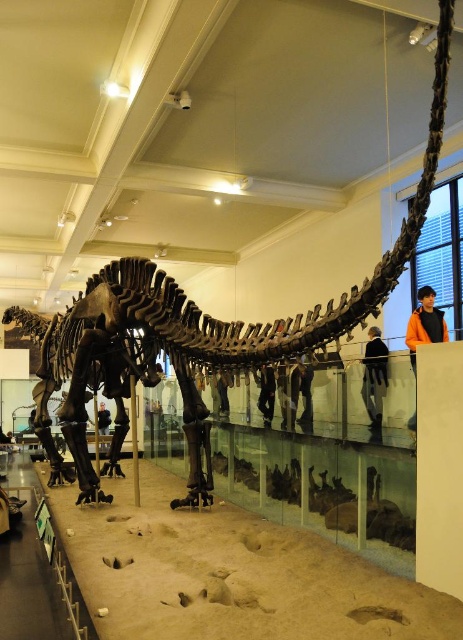
You are a visitor at the museum and see the black leather jacket at center and the matte black dinosaur at lower left. Which object is closer to you?

The black leather jacket at center is closer to you because it is in front of the matte black dinosaur at lower left.

Looking at this image, you are standing in the museum and see the dinosaur skeleton on the platform. You notice a point at coordinates (375, 378). What object is located at that point?

The point at coordinates (375, 378) has the black fabric at upper center.

You are a visitor at the museum and you see the black fabric at upper center and the black leather jacket at center. Which one is wider?

The black fabric at upper center might be wider than black leather jacket at center.